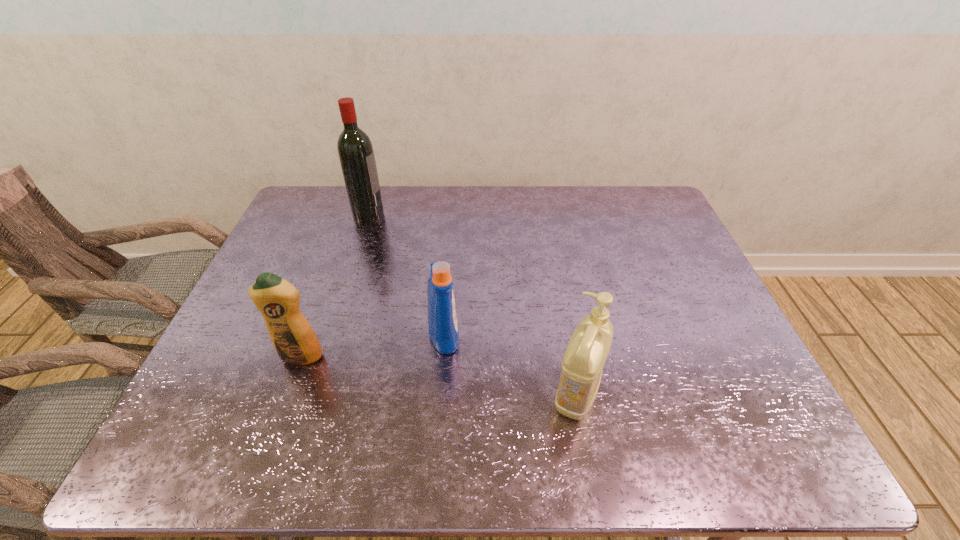
I want to click on the farthest object, so click(355, 150).

Locate an element on the screen. wine bottle is located at coordinates (355, 150).

Find the location of `the leftmost detergent`. the leftmost detergent is located at coordinates (292, 336).

Locate an element on the screen. Image resolution: width=960 pixels, height=540 pixels. the third object from left to right is located at coordinates (442, 319).

Where is `the rightmost object`? the rightmost object is located at coordinates (582, 365).

At what (x,y) coordinates should I click in order to perform the action: click on vacant space located on the label of the tallest object. Please return your answer as a coordinate pair (x, y). The height and width of the screenshot is (540, 960). Looking at the image, I should click on (492, 216).

This screenshot has width=960, height=540. I want to click on vacant space located 0.120m on the label of the leftmost detergent, so click(280, 413).

What are the coordinates of `free space located 0.340m on the label of the second detergent from left to right` in the screenshot? It's located at (594, 334).

Identify the location of free space located on the back of the rightmost object. The height and width of the screenshot is (540, 960). (561, 304).

Image resolution: width=960 pixels, height=540 pixels. Find the location of `object positioned at the far edge`. object positioned at the far edge is located at coordinates (355, 150).